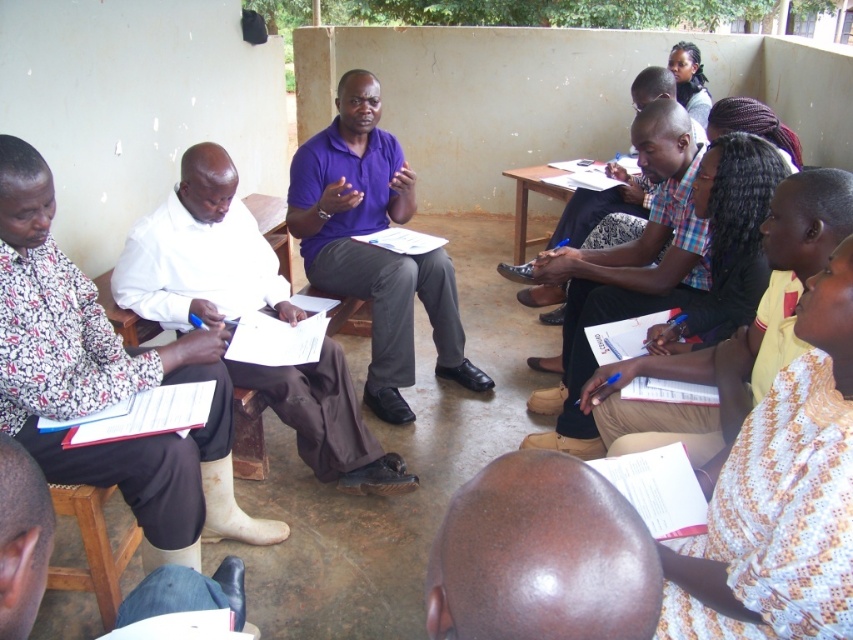
You are standing at the central figure and want to walk to the point labeled as point (115, 282). There is an obstacle at point (753, 563). Will you encounter this obstacle on your way?

Yes, because point (753, 563) is in front of point (115, 282), so the obstacle at point (753, 563) will be encountered on the way to point (115, 282).

You are a photographer trying to capture a closeup of the shiny brown head at center and the purple matte shirt at center in the scene. Since you want both subjects to appear similarly sized in the photo, which subject should you move closer to the camera?

The shiny brown head at center is smaller than the purple matte shirt at center, so you should move closer to the shiny brown head at center to make it appear larger in the photo and balance the sizes of both subjects.

You are a photographer standing at the back of the room. You want to capture a photo of the shiny brown head at center and the white printed dress at lower right in the same frame. The camera you are using has a minimum focus distance of 24 inches. Can you take the photo without moving either object?

The distance between the white printed dress at lower right and the shiny brown head at center is 25.23 inches, which is greater than the camera minimum focus distance of 24 inches. Therefore, you can take the photo without moving either object.